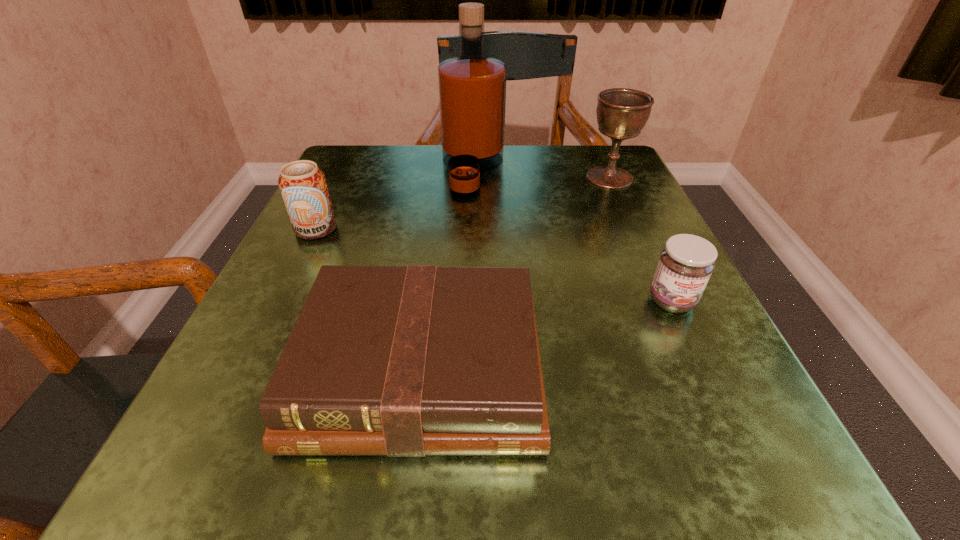
This screenshot has height=540, width=960. Identify the location of vacant position at the near edge of the desktop. (410, 480).

Find the location of a particular element. The height and width of the screenshot is (540, 960). vacant area at the left edge is located at coordinates (300, 272).

Identify the location of free space at the right edge. The image size is (960, 540). (626, 234).

Identify the location of vacant space at the far right corner of the desktop. Image resolution: width=960 pixels, height=540 pixels. (571, 166).

At what (x,y) coordinates should I click in order to perform the action: click on free region at the near right corner of the desktop. Please return your answer as a coordinate pair (x, y). The image size is (960, 540). Looking at the image, I should click on (733, 472).

The width and height of the screenshot is (960, 540). In order to click on empty space between the leftmost object and the jam in this screenshot , I will do `click(493, 265)`.

I want to click on empty location between the second shortest object and the third nearest object, so click(x=493, y=265).

You are a GUI agent. You are given a task and a screenshot of the screen. Output one action in this format:
    pyautogui.click(x=<x>, y=<y>)
    Task: Click on the free space between the second tallest object and the third nearest object
    
    Given the screenshot: What is the action you would take?
    pyautogui.click(x=463, y=204)

The width and height of the screenshot is (960, 540). I want to click on vacant point located between the fourth tallest object and the liquor, so click(x=572, y=235).

Locate an element on the screen. This screenshot has width=960, height=540. vacant space that's between the leftmost object and the chalice is located at coordinates (463, 204).